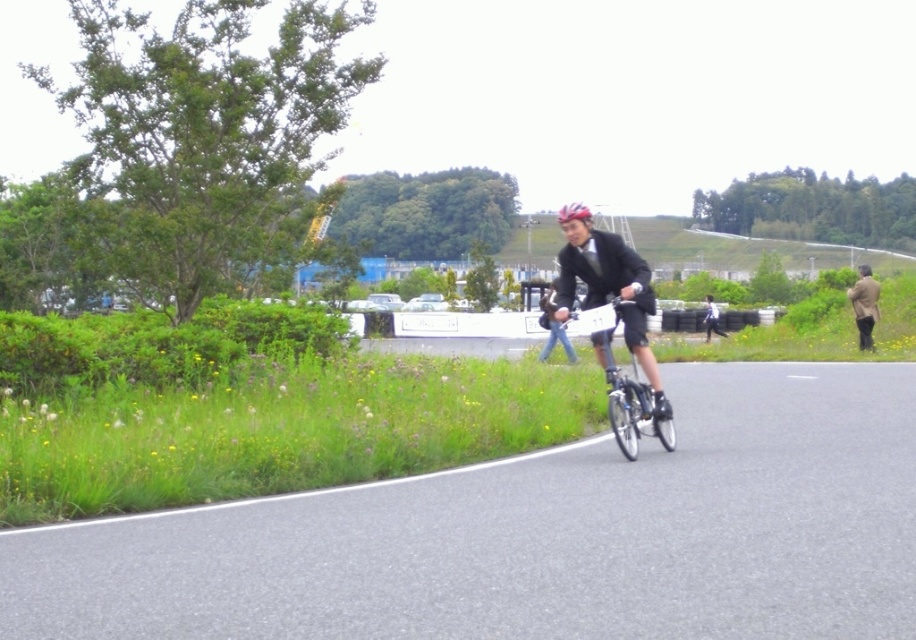
You are a drone operator trying to capture a photo of the cyclist. Your drone can only fly within a 25 meter radius of its starting position. If you position the drone at the shiny blue helmet at center, will it be able to capture the matte black suit at center in the photo?

The distance between the matte black suit at center and the shiny blue helmet at center is 26.94 meters. Since the drone can only fly within a 25 meter radius, it cannot reach the matte black suit at center from the shiny blue helmet at center. Therefore, the drone will not be able to capture the matte black suit at center in the photo.

You are a photographer standing at the starting line of a cycling event. You notice two cyclists ahead of you. One is wearing a matte black suit at center, and the other is wearing a brown leather jacket at right. Which cyclist is closer to you?

The matte black suit at center is shorter than the brown leather jacket at right, so the cyclist wearing the matte black suit at center is closer to you.